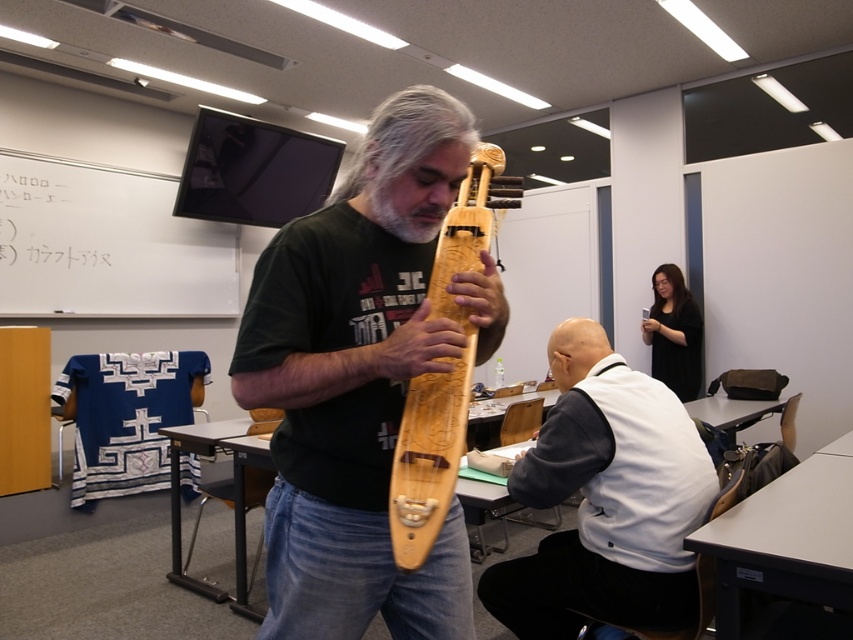
Is point (601, 496) positioned in front of point (389, 499)?

No, it is behind (389, 499).

Is point (575, 484) behind point (447, 483)?

Yes, point (575, 484) is behind point (447, 483).

What do you see at coordinates (605, 499) in the screenshot? This screenshot has width=853, height=640. I see `white matte vest at center` at bounding box center [605, 499].

In order to click on white matte vest at center in this screenshot , I will do `click(605, 499)`.

Does wooden carved instrument at center have a larger size compared to white matte vest at center?

Actually, wooden carved instrument at center might be smaller than white matte vest at center.

Is wooden carved instrument at center further to camera compared to white matte vest at center?

No, it is not.

Where is `wooden carved instrument at center`? wooden carved instrument at center is located at coordinates [357, 381].

Measure the distance from wooden carved instrument at center to wooden carved guitar at center.

A distance of 12.50 centimeters exists between wooden carved instrument at center and wooden carved guitar at center.

Consider the image. Can you confirm if wooden carved instrument at center is positioned below wooden carved guitar at center?

Yes, wooden carved instrument at center is below wooden carved guitar at center.

Who is more forward, [451,138] or [425,420]?

Positioned in front is point [451,138].

Locate an element on the screen. This screenshot has height=640, width=853. wooden carved instrument at center is located at coordinates (357, 381).